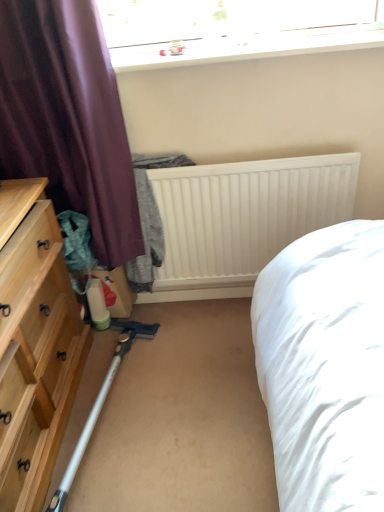
Question: Would you say natural wood dresser at left is inside or outside white plastic vacuum cleaner at lower left?

Choices:
 (A) outside
 (B) inside

Answer: (A)

Question: Considering the positions of point (21, 410) and point (82, 448), is point (21, 410) closer or farther from the camera than point (82, 448)?

Choices:
 (A) farther
 (B) closer

Answer: (B)

Question: Which is nearer to the white plastic vacuum cleaner at lower left?

Choices:
 (A) purple fabric curtain at left
 (B) transparent glass window at upper center
 (C) natural wood dresser at left
 (D) white matte radiator at center

Answer: (C)

Question: Considering the real-world distances, which object is farthest from the transparent glass window at upper center?

Choices:
 (A) natural wood dresser at left
 (B) purple fabric curtain at left
 (C) white plastic vacuum cleaner at lower left
 (D) white matte radiator at center

Answer: (C)